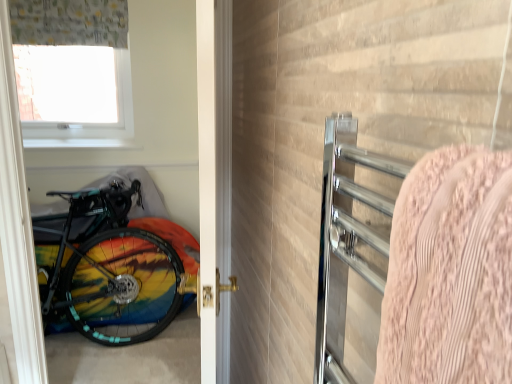
Question: Considering the positions of point (x=59, y=236) and point (x=458, y=340), is point (x=59, y=236) closer or farther from the camera than point (x=458, y=340)?

Choices:
 (A) closer
 (B) farther

Answer: (B)

Question: In terms of height, does rainbow painted bicycle at left look taller or shorter compared to pink textured towel at right?

Choices:
 (A) short
 (B) tall

Answer: (B)

Question: Which of these objects is positioned farthest from the white glossy door at center?

Choices:
 (A) transparent plastic window screen at upper left
 (B) pink textured towel at right
 (C) patterned fabric curtain at upper left
 (D) rainbow painted bicycle at left

Answer: (A)

Question: Which object is the farthest from the pink textured towel at right?

Choices:
 (A) patterned fabric curtain at upper left
 (B) rainbow painted bicycle at left
 (C) transparent plastic window screen at upper left
 (D) white glossy door at center

Answer: (C)